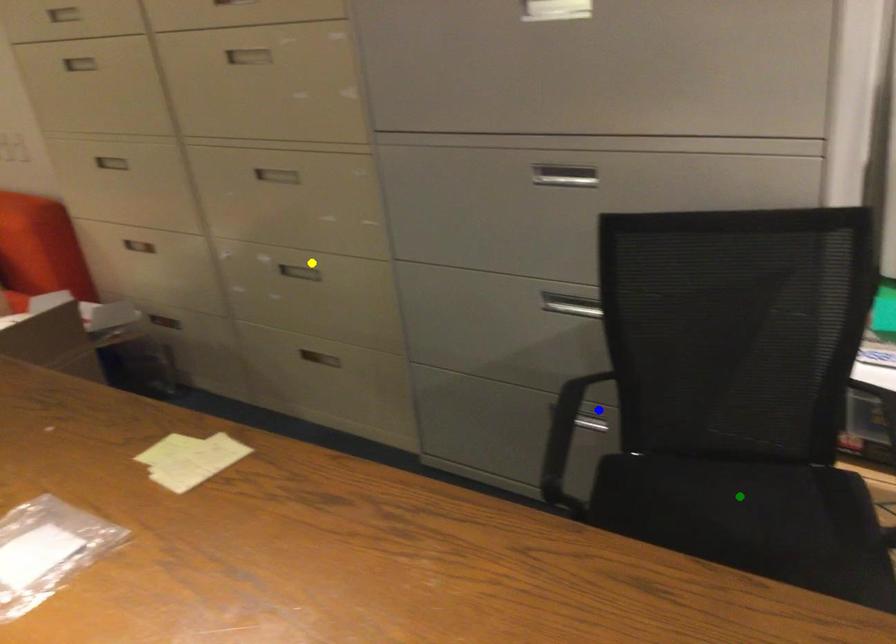
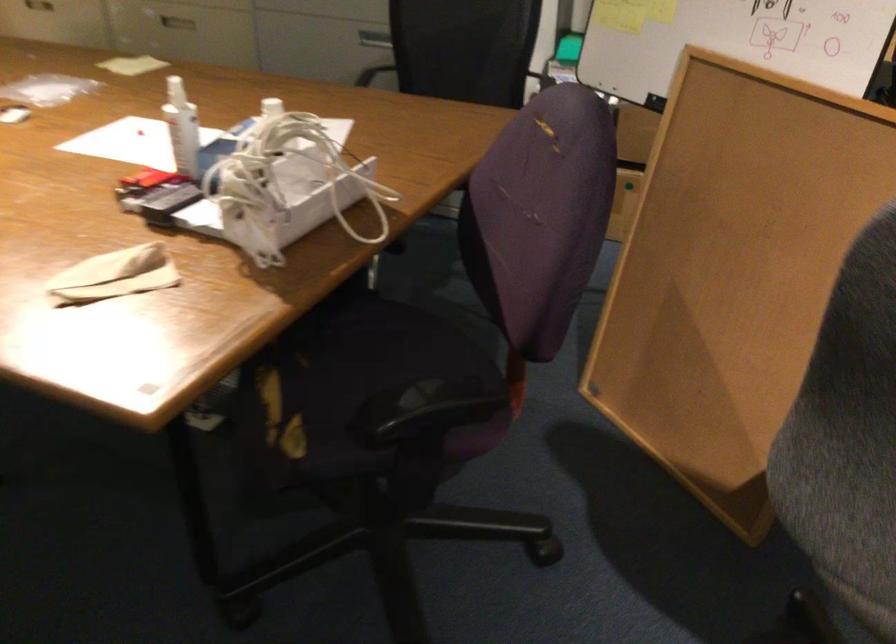
I am providing you with two images of the same scene from different viewpoints. Three points are marked in image1. Which point corresponds to a part or object that is occluded in image2?In image1, three points are marked. Which of them correspond to a part or object that is occluded in image2?Among the three points shown in image1, which one corresponds to a part or object that is no longer visible due to occlusion in image2?

green point, blue point cannot be seen in image2.